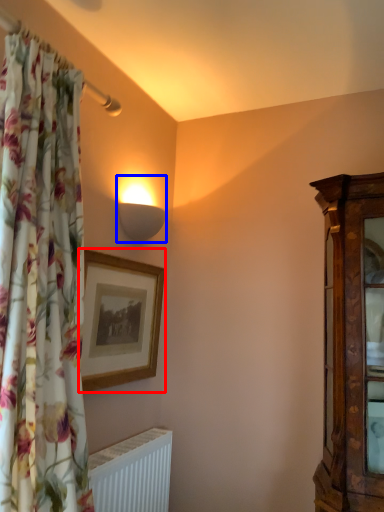
Question: Which object appears farthest to the camera in this image, picture frame (highlighted by a red box) or lamp (highlighted by a blue box)?

Choices:
 (A) picture frame
 (B) lamp

Answer: (B)